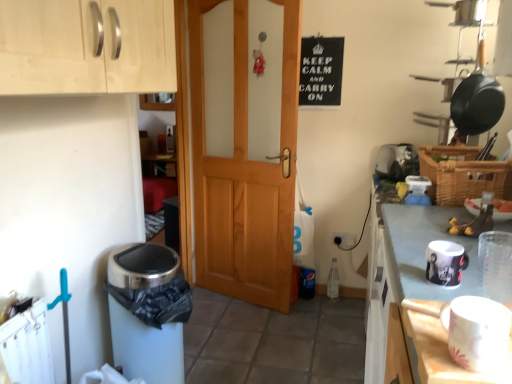
Question: Is light wood cabinet at upper left facing towards white matte table at lower right?

Choices:
 (A) no
 (B) yes

Answer: (A)

Question: Does light wood cabinet at upper left appear on the left side of white matte table at lower right?

Choices:
 (A) yes
 (B) no

Answer: (A)

Question: Can you see light wood cabinet at upper left touching white matte table at lower right?

Choices:
 (A) no
 (B) yes

Answer: (A)

Question: Is the position of light wood cabinet at upper left more distant than that of white matte table at lower right?

Choices:
 (A) no
 (B) yes

Answer: (B)

Question: Is light wood cabinet at upper left looking in the opposite direction of white matte table at lower right?

Choices:
 (A) no
 (B) yes

Answer: (A)

Question: Could white matte table at lower right be considered to be inside light wood cabinet at upper left?

Choices:
 (A) no
 (B) yes

Answer: (A)

Question: Can you confirm if white plastic toaster at upper right, positioned as the 1th appliance in back-to-front order, is taller than black matte sign at upper center?

Choices:
 (A) no
 (B) yes

Answer: (A)

Question: Considering the relative positions of white plastic toaster at upper right, positioned as the first appliance in right-to-left order, and black matte sign at upper center in the image provided, is white plastic toaster at upper right, positioned as the first appliance in right-to-left order, to the right of black matte sign at upper center from the viewer's perspective?

Choices:
 (A) yes
 (B) no

Answer: (A)

Question: Is the position of white plastic toaster at upper right, which is the second appliance from bottom to top, more distant than that of black matte sign at upper center?

Choices:
 (A) no
 (B) yes

Answer: (A)

Question: Is white plastic toaster at upper right, which is the second appliance from bottom to top, surrounding black matte sign at upper center?

Choices:
 (A) no
 (B) yes

Answer: (A)

Question: From the image's perspective, does white plastic toaster at upper right, positioned as the first appliance in right-to-left order, appear higher than black matte sign at upper center?

Choices:
 (A) no
 (B) yes

Answer: (A)

Question: Considering the relative positions of white plastic toaster at upper right, positioned as the 2th appliance in front-to-back order, and black matte sign at upper center in the image provided, is white plastic toaster at upper right, positioned as the 2th appliance in front-to-back order, to the left of black matte sign at upper center from the viewer's perspective?

Choices:
 (A) no
 (B) yes

Answer: (A)

Question: Can you confirm if matte black mug at right, acting as the first appliance starting from the front, is smaller than black matte sign at upper center?

Choices:
 (A) no
 (B) yes

Answer: (B)